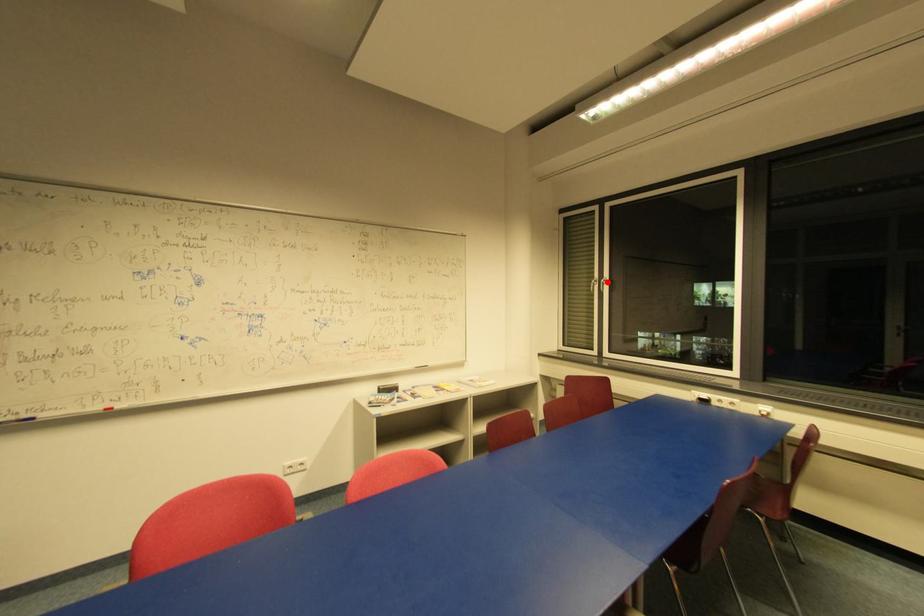
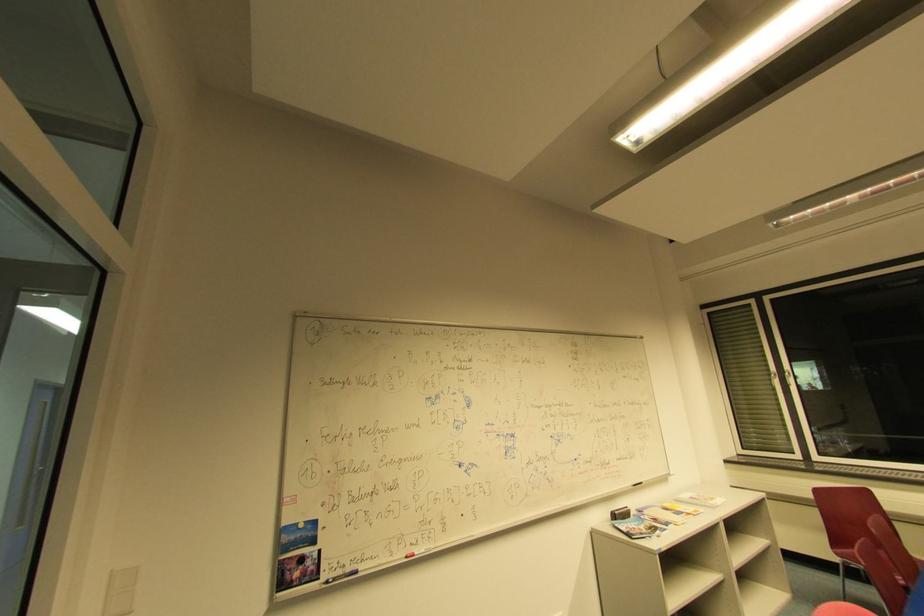
Question: A red point is marked in image1. In image2, is the corresponding 3D point closer to the camera or farther? Reply with the corresponding letter.

Choices:
 (A) The corresponding 3D point is closer.
 (B) The corresponding 3D point is farther.

Answer: (A)